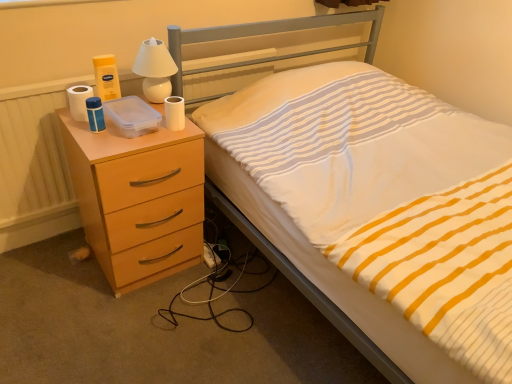
Image resolution: width=512 pixels, height=384 pixels. In order to click on free space to the left of white matte toilet paper at upper right, the 1th toilet paper from the right in this screenshot , I will do `click(134, 132)`.